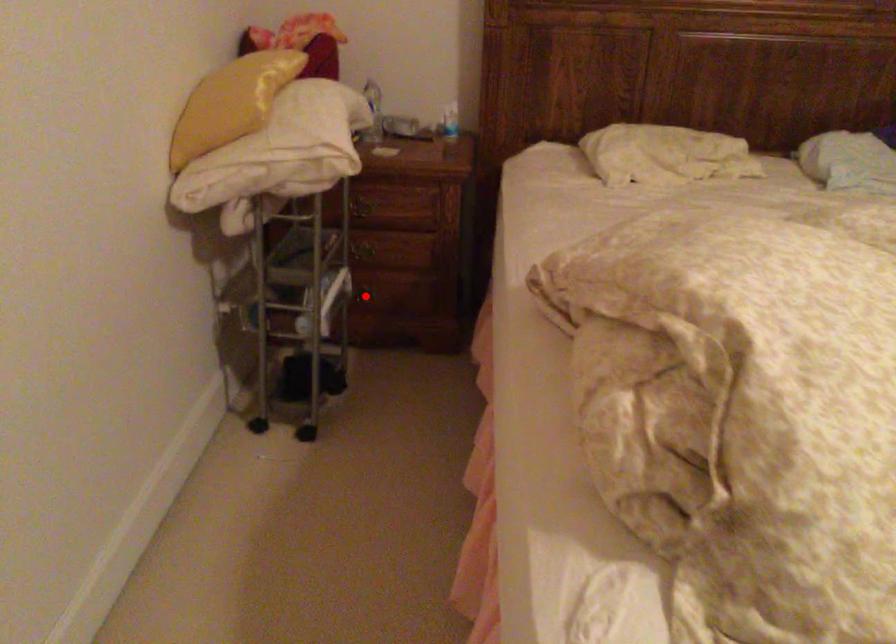
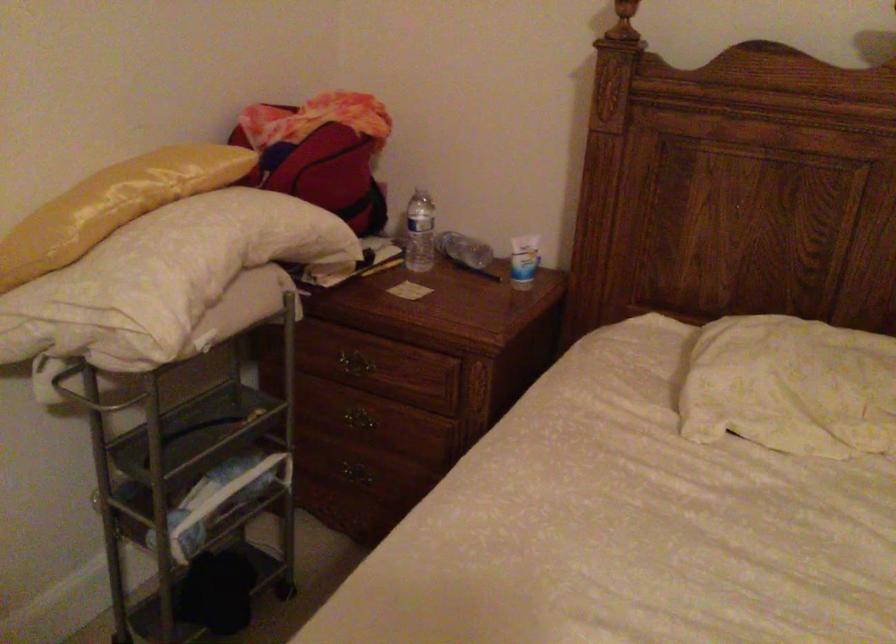
Question: I am providing you with two images of the same scene from different viewpoints. Given a red point in image1, look at the same physical point in image2. Is it:

Choices:
 (A) Closer to the viewpoint
 (B) Farther from the viewpoint

Answer: (A)